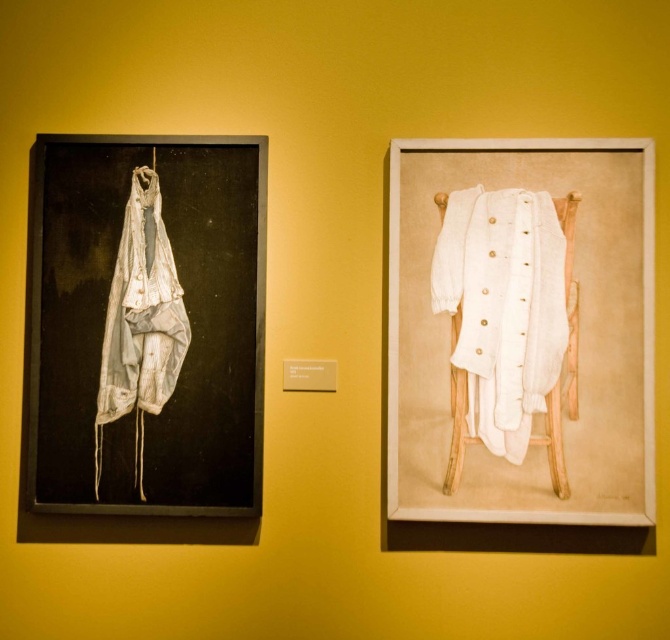
You are an interior designer arranging a gallery wall. You have the white cotton coat at right and the matte white hanger at upper left in your design. Which object is located lower on the wall?

The white cotton coat at right is positioned under the matte white hanger at upper left, so it is located lower on the wall.